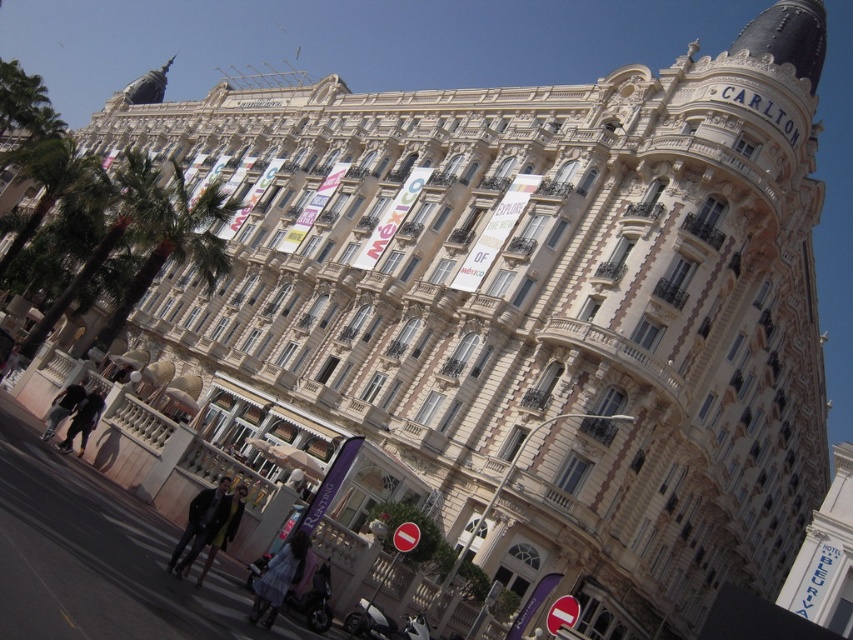
This screenshot has height=640, width=853. I want to click on leather jacket at lower center, so click(x=210, y=525).

What do you see at coordinates (210, 525) in the screenshot?
I see `leather jacket at lower center` at bounding box center [210, 525].

Does point (207, 547) lie behind point (265, 588)?

Yes, it is behind point (265, 588).

The width and height of the screenshot is (853, 640). Identify the location of leather jacket at lower center. (210, 525).

Find the location of a particular element. The image size is (853, 640). leather jacket at lower center is located at coordinates (210, 525).

Can you confirm if leather jacket at lower center is thinner than black leather pants at lower left?

Correct, leather jacket at lower center's width is less than black leather pants at lower left's.

Identify the location of leather jacket at lower center. The width and height of the screenshot is (853, 640). (210, 525).

Where is `leather jacket at lower center`? leather jacket at lower center is located at coordinates (210, 525).

Who is higher up, light blue denim dress at lower center or black leather pants at lower left?

black leather pants at lower left is higher up.

Which of these two, light blue denim dress at lower center or black leather pants at lower left, stands shorter?

With less height is black leather pants at lower left.

Image resolution: width=853 pixels, height=640 pixels. What do you see at coordinates (277, 579) in the screenshot? I see `light blue denim dress at lower center` at bounding box center [277, 579].

Locate an element on the screen. The width and height of the screenshot is (853, 640). light blue denim dress at lower center is located at coordinates (277, 579).